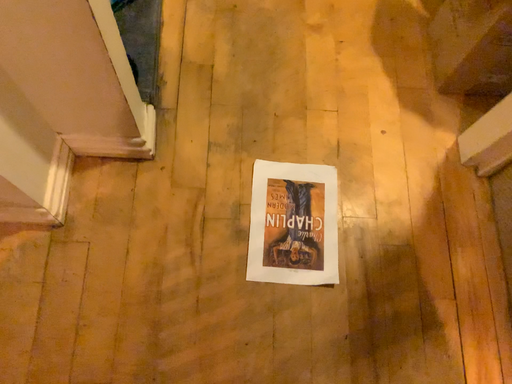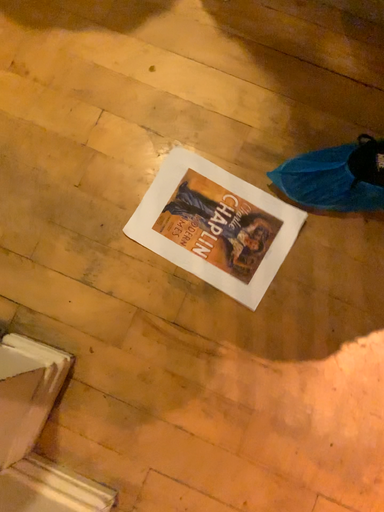
Question: How did the camera likely rotate when shooting the video?

Choices:
 (A) rotated left
 (B) rotated right

Answer: (B)